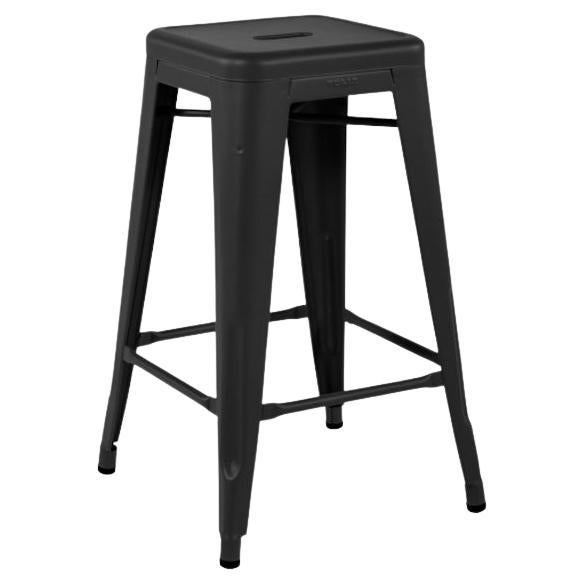
I want to click on foot rest, so click(385, 389), click(388, 336), click(192, 328), click(180, 383).